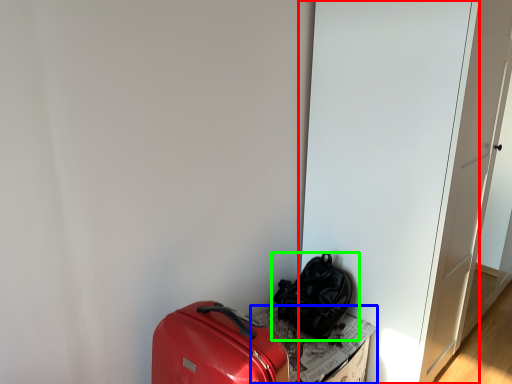
Question: Which is farther away from door (highlighted by a red box)? cardboard box (highlighted by a blue box) or luggage and bags (highlighted by a green box)?

Choices:
 (A) cardboard box
 (B) luggage and bags

Answer: (A)